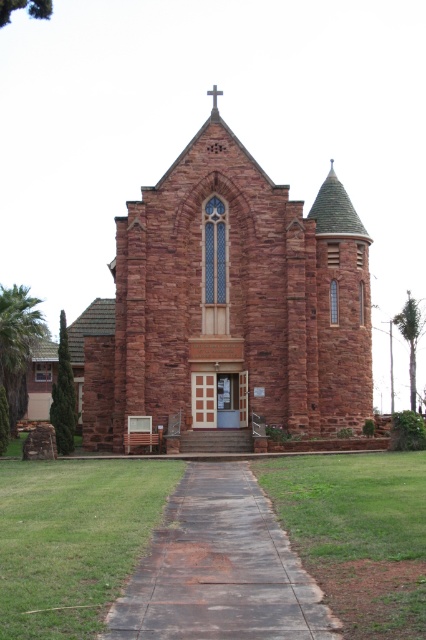
Between point (322, 316) and point (219, 529), which one is positioned behind?

Point (322, 316)

Who is higher up, reddish-brown stone church at center or concrete sidewalk at center?

reddish-brown stone church at center is higher up.

This screenshot has width=426, height=640. Describe the element at coordinates (230, 304) in the screenshot. I see `reddish-brown stone church at center` at that location.

Find the location of `reddish-brown stone church at center`. reddish-brown stone church at center is located at coordinates (230, 304).